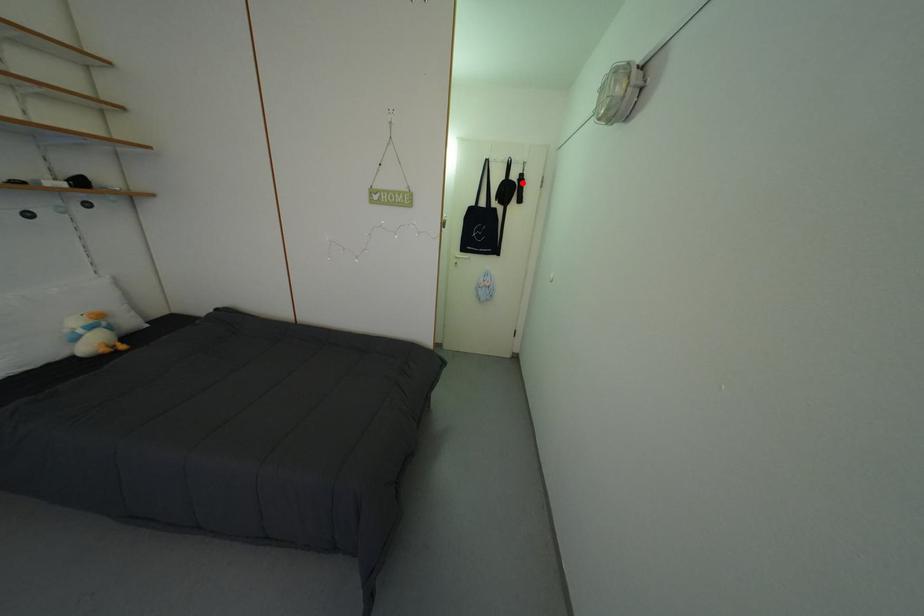
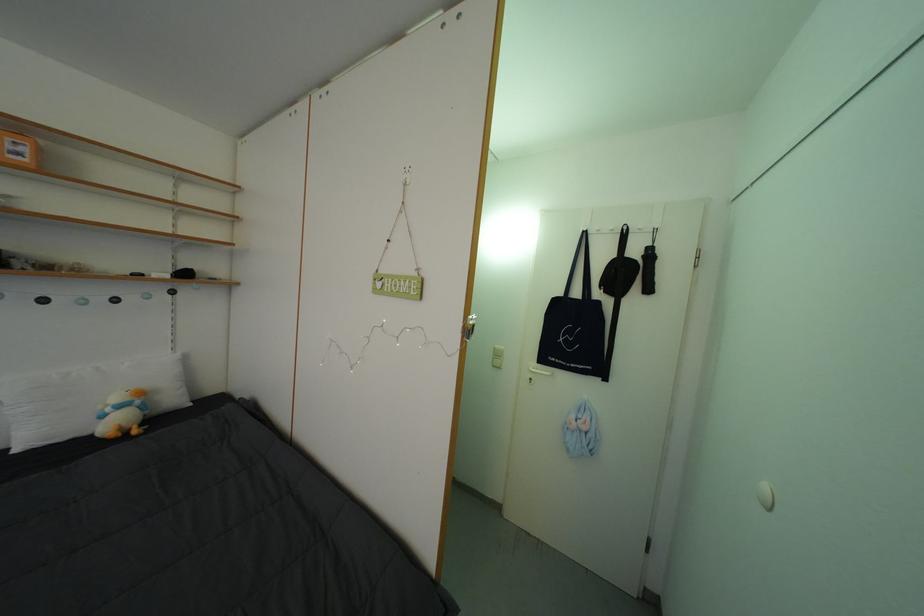
Question: I am providing you with two images of the same scene from different viewpoints. Image1 has a red point marked. In image2, the corresponding 3D location appears at what relative position? Reply with the corresponding letter.

Choices:
 (A) Closer
 (B) Farther

Answer: (B)